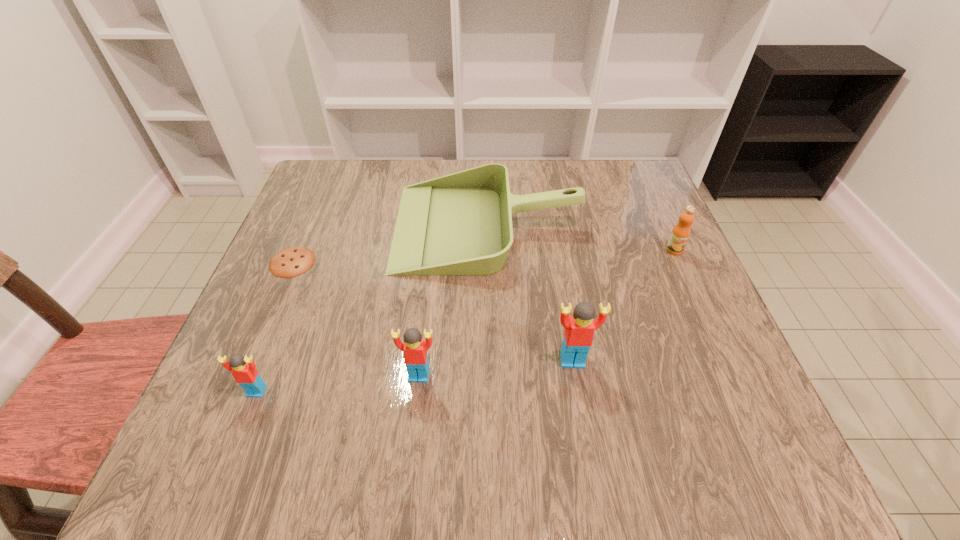
In the image, there is a desktop. In order to click on free space at the left edge in this screenshot , I will do `click(310, 342)`.

The height and width of the screenshot is (540, 960). Identify the location of free space at the right edge of the desktop. (634, 227).

You are a GUI agent. You are given a task and a screenshot of the screen. Output one action in this format:
    pyautogui.click(x=<x>, y=<y>)
    Task: Click on the free location at the far left corner
    This screenshot has height=540, width=960.
    Given the screenshot: What is the action you would take?
    pyautogui.click(x=347, y=172)

At what (x,y) coordinates should I click in order to perform the action: click on blank area at the far right corner. Please return your answer as a coordinate pair (x, y). Looking at the image, I should click on (615, 159).

The width and height of the screenshot is (960, 540). I want to click on free space between the leftmost Lego and the second Lego from right to left, so click(338, 383).

The height and width of the screenshot is (540, 960). What are the coordinates of `free space between the rightmost object and the tallest Lego` in the screenshot? It's located at (623, 305).

Locate an element on the screen. This screenshot has width=960, height=540. vacant space that is in between the rightmost Lego and the second shortest Lego is located at coordinates (495, 368).

Identify the location of vacant space that's between the cookie and the nearest object. pos(275,327).

You are a GUI agent. You are given a task and a screenshot of the screen. Output one action in this format:
    pyautogui.click(x=<x>, y=<y>)
    Task: Click on the free point between the second tallest Lego and the shortest object
    This screenshot has height=540, width=960.
    Given the screenshot: What is the action you would take?
    pyautogui.click(x=355, y=319)

Image resolution: width=960 pixels, height=540 pixels. What are the coordinates of `free space between the dustpan and the second tallest Lego` in the screenshot? It's located at (453, 301).